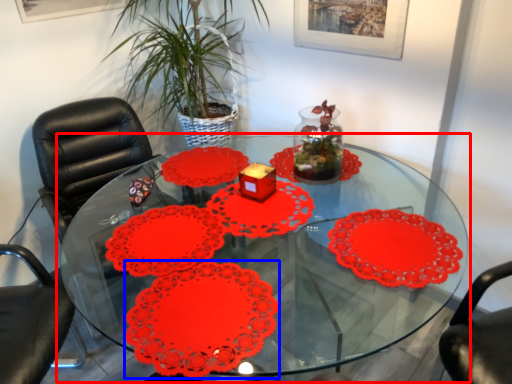
Question: Among these objects, which one is farthest to the camera, table (highlighted by a red box) or flower (highlighted by a blue box)?

Choices:
 (A) table
 (B) flower

Answer: (B)